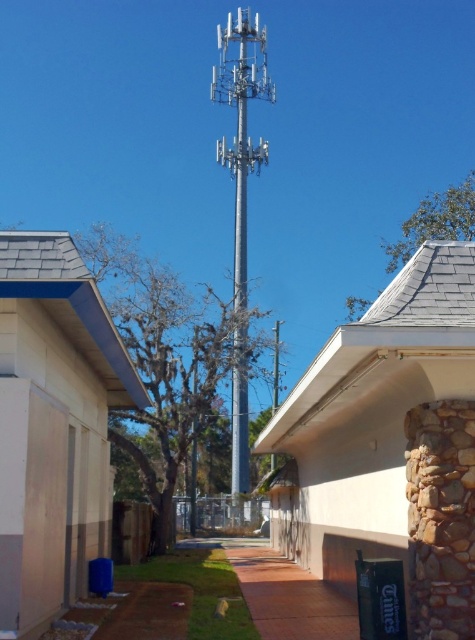
Looking at this image, you are a technician who needs to install a new device between the silver metallic tower at center and the silver metallic pole at center. The device requires a minimum of 20 inches of space to function properly. Based on the scene, will there be enough space between them for the installation?

The distance between the silver metallic tower at center and the silver metallic pole at center is 25.70 inches, which exceeds the required 20 inches. Therefore, there is sufficient space for the installation.